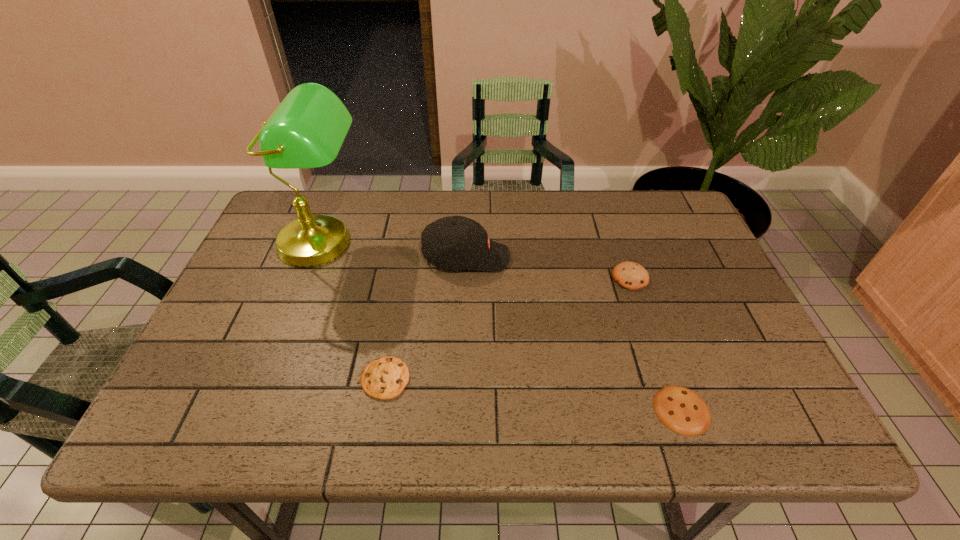
Locate an element on the screen. vacant point located between the leftmost cookie and the second tallest object is located at coordinates (425, 318).

You are a GUI agent. You are given a task and a screenshot of the screen. Output one action in this format:
    pyautogui.click(x=<x>, y=<y>)
    Task: Click on the vacant region between the leftmost cookie and the third shortest object
    
    Given the screenshot: What is the action you would take?
    pyautogui.click(x=508, y=328)

Where is `empty location between the shortest object and the third shortest object`? The height and width of the screenshot is (540, 960). empty location between the shortest object and the third shortest object is located at coordinates (656, 343).

What are the coordinates of `unoccupied area between the tallest cookie and the baseball cap` in the screenshot? It's located at (548, 267).

The image size is (960, 540). I want to click on unoccupied position between the tallest object and the fourth shortest object, so click(395, 251).

Where is `free spot between the leftmost cookie and the shortest object`? free spot between the leftmost cookie and the shortest object is located at coordinates (534, 394).

I want to click on vacant area that lies between the farthest cookie and the shortest cookie, so click(x=656, y=343).

Find the location of a particular element. empty space that is in between the shortest object and the third shortest object is located at coordinates (656, 343).

Locate an element on the screen. The image size is (960, 540). empty space that is in between the shortest cookie and the lamp is located at coordinates click(502, 327).

Choose which object is the fourth nearest neighbor to the leftmost cookie. Please provide its 2D coordinates. Your answer should be formatted as a tuple, i.e. [(x, y)], where the tuple contains the x and y coordinates of a point satisfying the conditions above.

[(629, 275)]